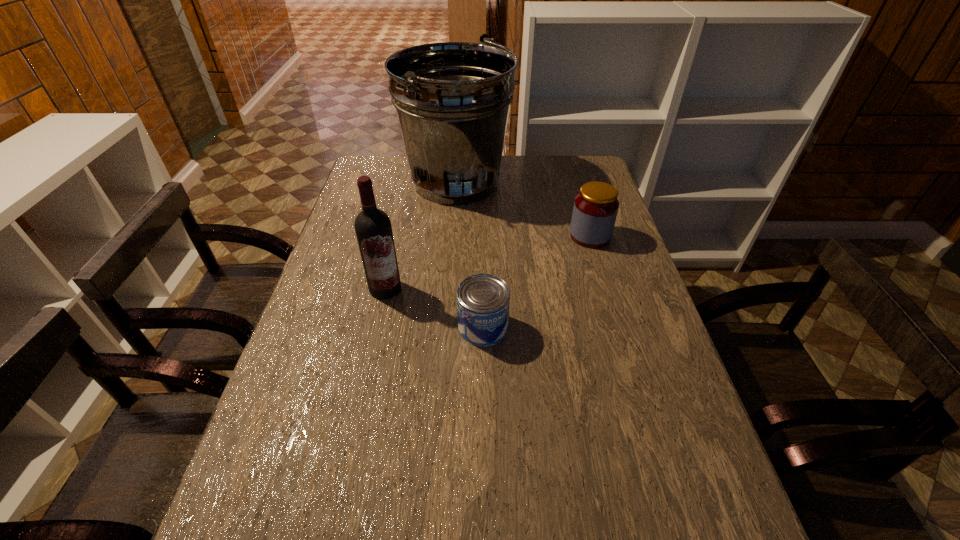
Image resolution: width=960 pixels, height=540 pixels. I want to click on the farthest object, so click(x=452, y=99).

At what (x,y) coordinates should I click in order to perform the action: click on bucket. Please return your answer as a coordinate pair (x, y). This screenshot has height=540, width=960. Looking at the image, I should click on (452, 99).

The width and height of the screenshot is (960, 540). What are the coordinates of `wine bottle` in the screenshot? It's located at [373, 228].

The image size is (960, 540). Identify the location of the third shortest object. (373, 228).

Locate an element on the screen. This screenshot has width=960, height=540. jar is located at coordinates (595, 209).

I want to click on the third tallest object, so click(x=595, y=209).

Image resolution: width=960 pixels, height=540 pixels. What are the coordinates of `can` in the screenshot? It's located at (483, 300).

Where is `the shortest object`? The height and width of the screenshot is (540, 960). the shortest object is located at coordinates [x=483, y=300].

You are a GUI agent. You are given a task and a screenshot of the screen. Output one action in this format:
    pyautogui.click(x=<x>, y=<y>)
    Task: Click on the free point located on the front of the farthest object
    
    Given the screenshot: What is the action you would take?
    pyautogui.click(x=450, y=263)

Locate an element on the screen. The image size is (960, 540). vacant region located 0.370m on the label of the wine bottle is located at coordinates (354, 427).